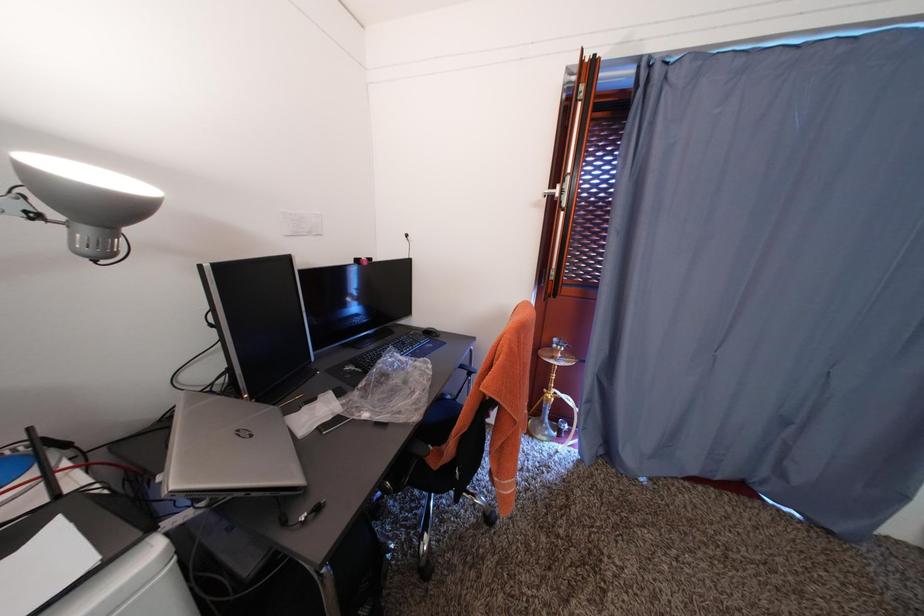
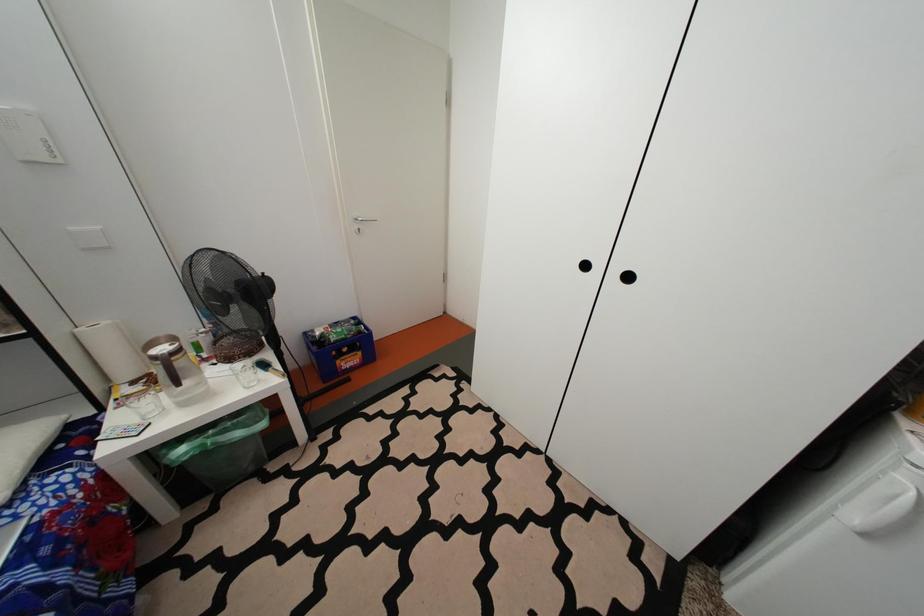
The images are taken continuously from a first-person perspective. In which direction is your viewpoint rotating?

The camera rotated toward left-down.